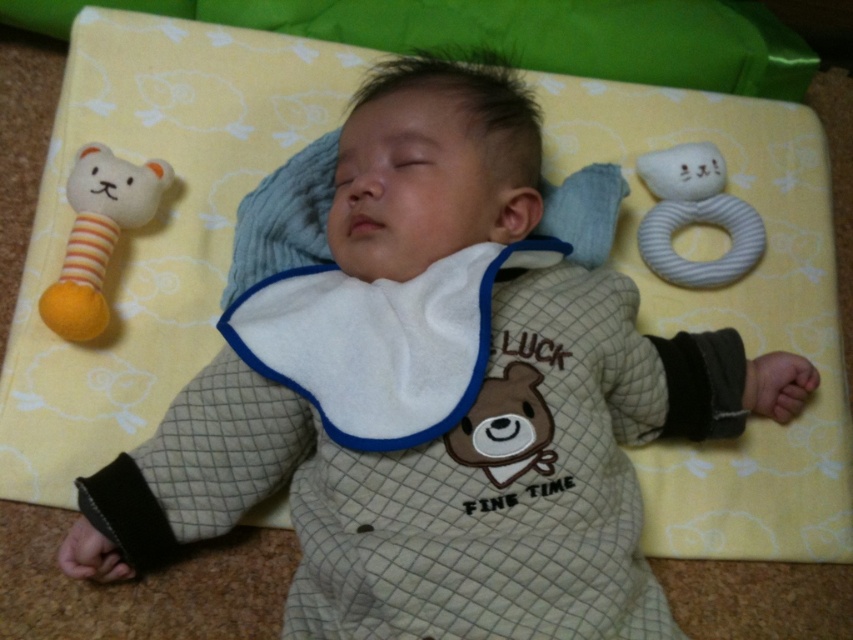
Looking at this image, is white fabric ring at upper right closer to the viewer compared to brown plush bear at center?

No, it is not.

Does white fabric ring at upper right appear under brown plush bear at center?

Incorrect, white fabric ring at upper right is not positioned below brown plush bear at center.

Identify the location of white fabric ring at upper right. Image resolution: width=853 pixels, height=640 pixels. (694, 216).

Is yellow striped plush toy at left smaller than brown plush bear at center?

Actually, yellow striped plush toy at left might be larger than brown plush bear at center.

Who is shorter, yellow striped plush toy at left or brown plush bear at center?

With less height is brown plush bear at center.

Locate an element on the screen. yellow striped plush toy at left is located at coordinates (97, 236).

Does yellow striped plush toy at left appear on the right side of white fabric ring at upper right?

No, yellow striped plush toy at left is not to the right of white fabric ring at upper right.

At what (x,y) coordinates should I click in order to perform the action: click on yellow striped plush toy at left. Please return your answer as a coordinate pair (x, y). Looking at the image, I should click on (97, 236).

Is point (160, 161) positioned behind point (717, 211)?

That is False.

You are a GUI agent. You are given a task and a screenshot of the screen. Output one action in this format:
    pyautogui.click(x=<x>, y=<y>)
    Task: Click on the yellow striped plush toy at left
    The width and height of the screenshot is (853, 640).
    Given the screenshot: What is the action you would take?
    pyautogui.click(x=97, y=236)